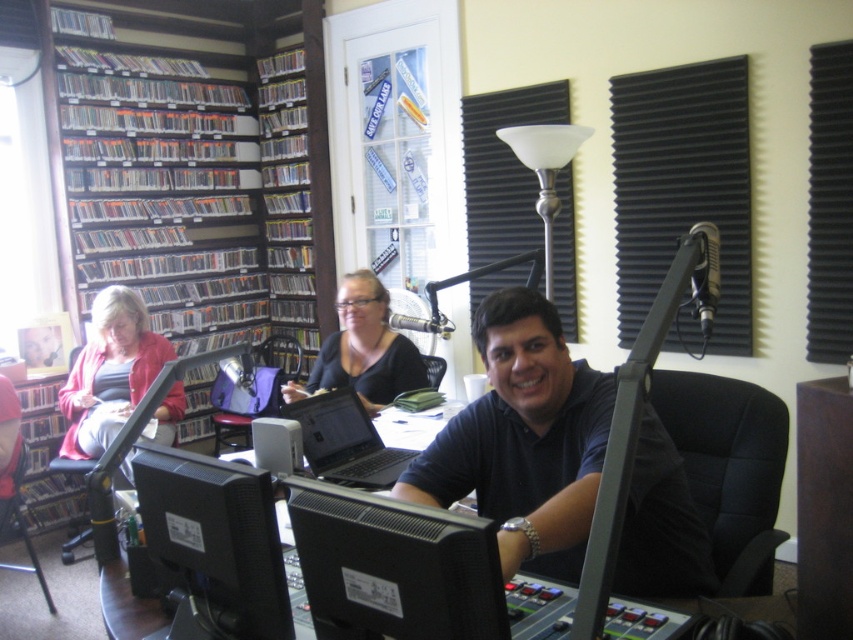
You are a guest in the radio studio and want to place a small notebook between the black glossy monitor at center and the matte pink sweater at left. Based on their sizes, which object should the notebook be placed closer to?

The black glossy monitor at center has a smaller size compared to the matte pink sweater at left, so the notebook should be placed closer to the matte pink sweater at left to ensure it fits better.